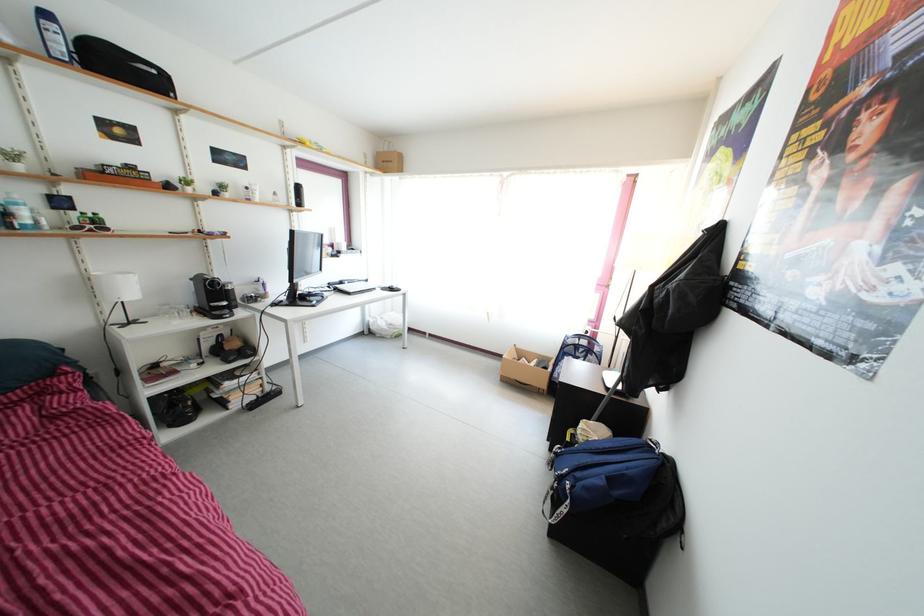
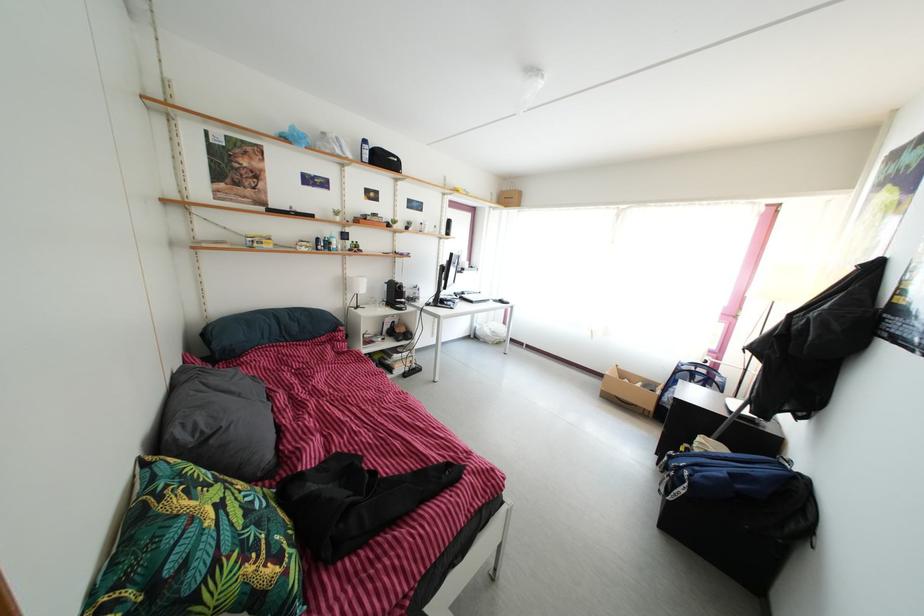
Find the pixel in the second image that matches [570,517] in the first image.

(687, 499)